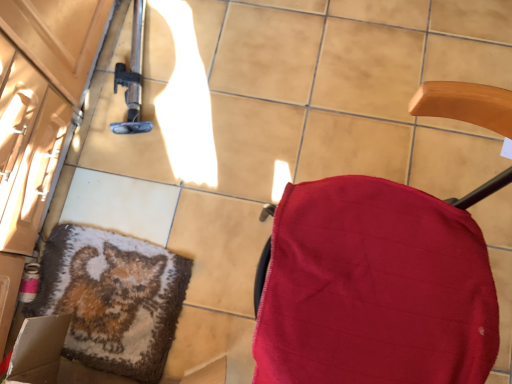
Question: Considering the relative sizes of red fabric chair at right and fluffy woolen mat at lower left in the image provided, is red fabric chair at right taller than fluffy woolen mat at lower left?

Choices:
 (A) yes
 (B) no

Answer: (A)

Question: Is red fabric chair at right shorter than fluffy woolen mat at lower left?

Choices:
 (A) yes
 (B) no

Answer: (B)

Question: Could you tell me if red fabric chair at right is facing fluffy woolen mat at lower left?

Choices:
 (A) yes
 (B) no

Answer: (A)

Question: Does red fabric chair at right have a larger size compared to fluffy woolen mat at lower left?

Choices:
 (A) no
 (B) yes

Answer: (B)

Question: From a real-world perspective, is red fabric chair at right beneath fluffy woolen mat at lower left?

Choices:
 (A) no
 (B) yes

Answer: (A)

Question: Is red fabric chair at right oriented away from fluffy woolen mat at lower left?

Choices:
 (A) yes
 (B) no

Answer: (B)

Question: From a real-world perspective, is fluffy woolen mat at lower left below red fabric chair at right?

Choices:
 (A) no
 (B) yes

Answer: (B)

Question: Is fluffy woolen mat at lower left completely or partially outside of red fabric chair at right?

Choices:
 (A) no
 (B) yes

Answer: (B)

Question: Is fluffy woolen mat at lower left thinner than red fabric chair at right?

Choices:
 (A) no
 (B) yes

Answer: (B)

Question: Is fluffy woolen mat at lower left not close to red fabric chair at right?

Choices:
 (A) no
 (B) yes

Answer: (A)

Question: Considering the relative sizes of fluffy woolen mat at lower left and red fabric chair at right in the image provided, is fluffy woolen mat at lower left wider than red fabric chair at right?

Choices:
 (A) no
 (B) yes

Answer: (A)

Question: Is fluffy woolen mat at lower left further to the viewer compared to red fabric chair at right?

Choices:
 (A) no
 (B) yes

Answer: (B)

Question: Considering the positions of red fabric chair at right and fluffy woolen mat at lower left in the image, is red fabric chair at right taller or shorter than fluffy woolen mat at lower left?

Choices:
 (A) tall
 (B) short

Answer: (A)